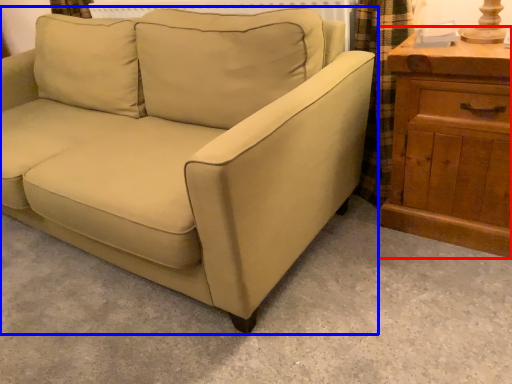
Question: Among these objects, which one is nearest to the camera, chest of drawers (highlighted by a red box) or studio couch (highlighted by a blue box)?

Choices:
 (A) chest of drawers
 (B) studio couch

Answer: (B)